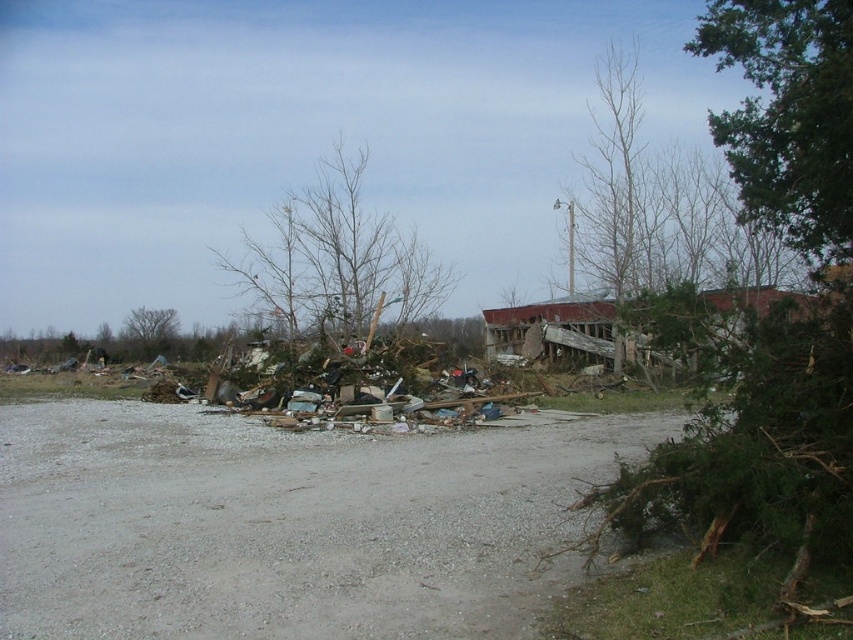
Can you confirm if green leafy tree at upper right is positioned to the left of bare wood tree at center?

In fact, green leafy tree at upper right is to the right of bare wood tree at center.

Who is shorter, green leafy tree at upper right or bare wood tree at center?

bare wood tree at center is shorter.

Does point (753, 12) come farther from viewer compared to point (303, 314)?

No, it is in front of (303, 314).

Locate an element on the screen. This screenshot has height=640, width=853. green leafy tree at upper right is located at coordinates (787, 115).

You are a GUI agent. You are given a task and a screenshot of the screen. Output one action in this format:
    pyautogui.click(x=<x>, y=<y>)
    Task: Click on the bare wood tree at center
    The image size is (853, 640).
    Given the screenshot: What is the action you would take?
    pyautogui.click(x=338, y=259)

Which of these two, bare wood tree at center or green leafy tree at upper left, stands taller?

With more height is bare wood tree at center.

Between point (363, 333) and point (158, 310), which one is positioned behind?

The point (158, 310) is more distant.

The width and height of the screenshot is (853, 640). Identify the location of bare wood tree at center. (338, 259).

This screenshot has width=853, height=640. What are the coordinates of `green leafy tree at upper right` in the screenshot? It's located at (787, 115).

Is green leafy tree at upper right thinner than green leafy tree at upper left?

Incorrect, green leafy tree at upper right's width is not less than green leafy tree at upper left's.

Does point (764, 132) come farther from viewer compared to point (149, 349)?

No, it is not.

Where is `green leafy tree at upper right`? The height and width of the screenshot is (640, 853). green leafy tree at upper right is located at coordinates (787, 115).